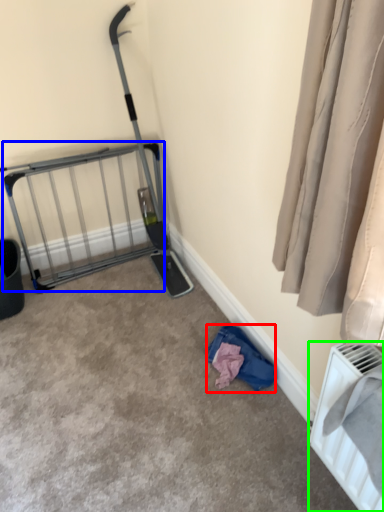
Question: Which object is the farthest from clothing (highlighted by a red box)? Choose among these: cage (highlighted by a blue box) or radiator (highlighted by a green box).

Choices:
 (A) cage
 (B) radiator

Answer: (A)